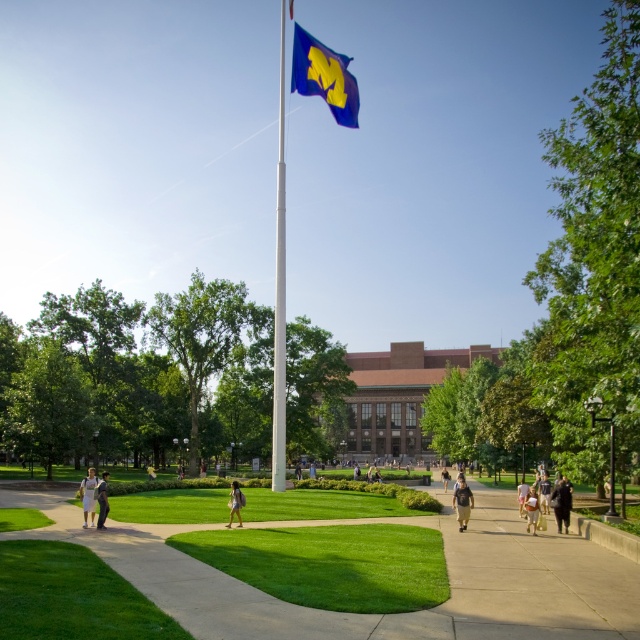
Question: Which point is farther to the camera?

Choices:
 (A) (444, 476)
 (B) (93, 484)
 (C) (104, 518)
 (D) (563, 486)

Answer: (A)

Question: Is light brown leather backpack at lower center above light brown leather jacket at center?

Choices:
 (A) no
 (B) yes

Answer: (B)

Question: Which object appears farthest from the camera in this image?

Choices:
 (A) white glossy flag pole at center
 (B) light brown leather jacket at lower left
 (C) blue matte flag at upper center

Answer: (A)

Question: Is light brown leather jacket at lower right thinner than light brown leather jacket at center?

Choices:
 (A) no
 (B) yes

Answer: (A)

Question: Which object is the farthest from the dark gray shirt at center?

Choices:
 (A) dark brown leather jacket at lower right
 (B) dark brown leather backpack at lower center
 (C) blue matte flag at upper center
 (D) light brown leather jacket at center

Answer: (B)

Question: Can you confirm if white cotton dress at lower left is smaller than light brown leather jacket at center?

Choices:
 (A) no
 (B) yes

Answer: (B)